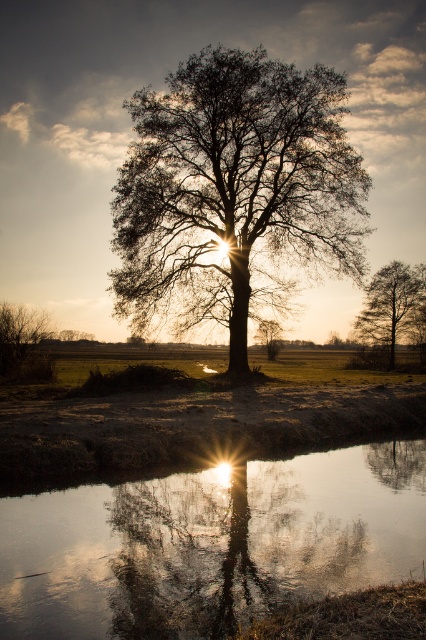
Which is more to the right, transparent reflective water at center or smooth bark tree at right?

smooth bark tree at right is more to the right.

Which is behind, point (163, 518) or point (409, 273)?

The point (409, 273) is behind.

The width and height of the screenshot is (426, 640). What do you see at coordinates (210, 545) in the screenshot?
I see `transparent reflective water at center` at bounding box center [210, 545].

Identify the location of transparent reflective water at center. (210, 545).

Who is shorter, silhouette leafy tree at center or smooth bark tree at right?

With less height is smooth bark tree at right.

Can you confirm if silhouette leafy tree at center is taller than smooth bark tree at right?

Indeed, silhouette leafy tree at center has a greater height compared to smooth bark tree at right.

Who is more forward, (298, 161) or (389, 266)?

Point (298, 161) is more forward.

Locate an element on the screen. This screenshot has height=640, width=426. silhouette leafy tree at center is located at coordinates (233, 189).

Is point (376, 280) positioned after point (36, 378)?

That is True.

Is smooth bark tree at right closer to the viewer compared to green matte bush at lower left?

That is False.

Does point (405, 308) come in front of point (2, 304)?

No, (405, 308) is further to viewer.

Find the location of a particular element. smooth bark tree at right is located at coordinates (394, 305).